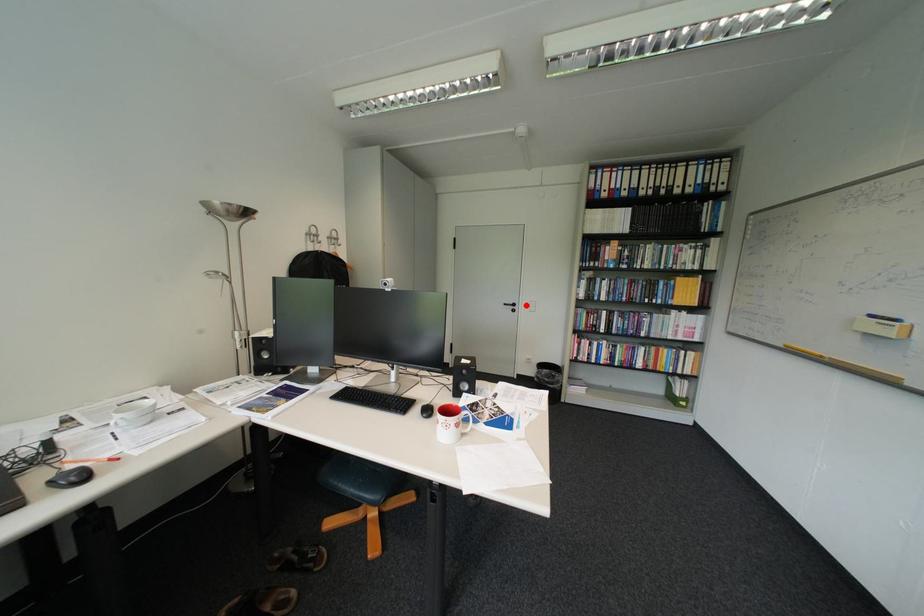
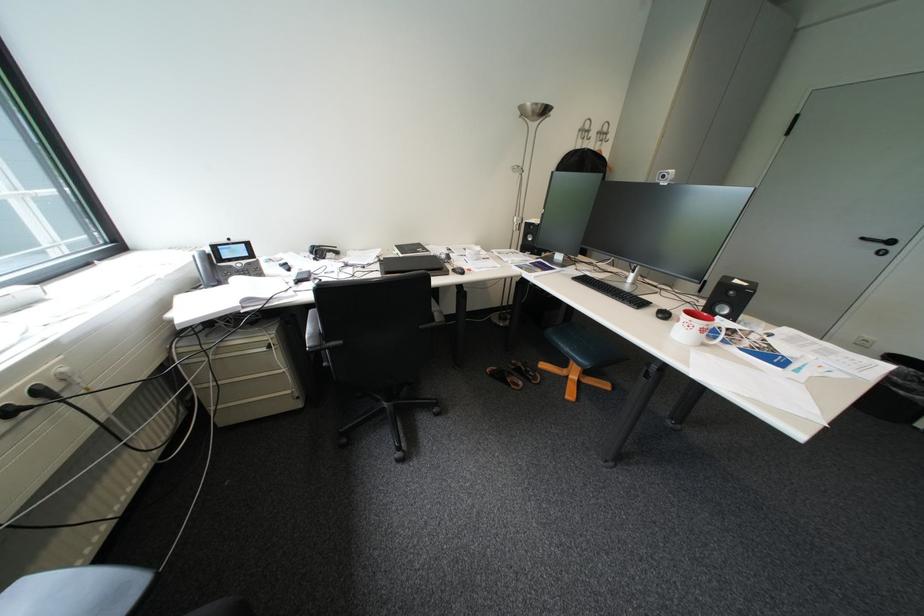
In the second image, find the point that corresponds to the highlighted location in the first image.

(904, 243)